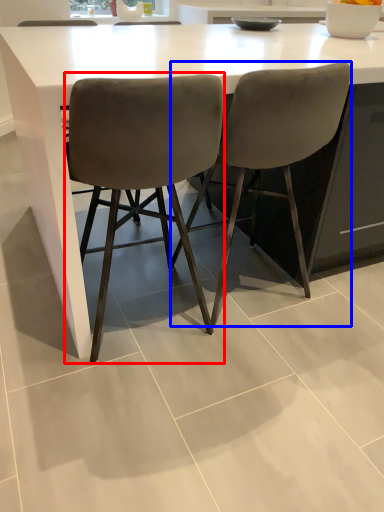
Question: Among these objects, which one is farthest to the camera, chair (highlighted by a red box) or chair (highlighted by a blue box)?

Choices:
 (A) chair
 (B) chair

Answer: (B)